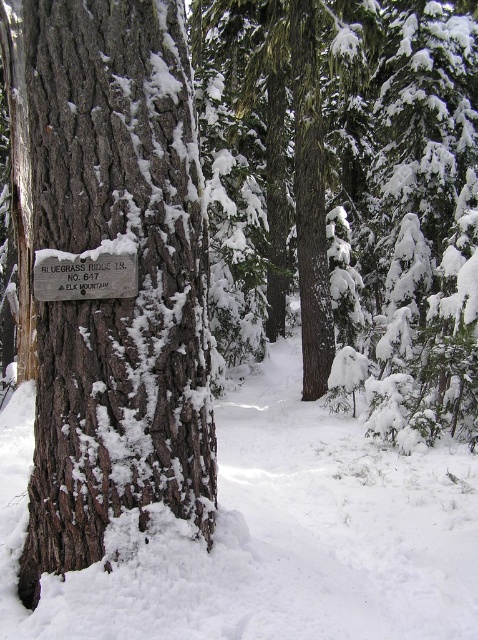
Question: Does dark brown textured bark at center appear over silver metallic sign at left?

Choices:
 (A) yes
 (B) no

Answer: (B)

Question: Is dark brown textured bark at center positioned before white fluffy snow at lower center?

Choices:
 (A) yes
 (B) no

Answer: (B)

Question: Which point appears farthest from the camera in this image?

Choices:
 (A) tap(113, 125)
 (B) tap(467, 545)

Answer: (B)

Question: Among these objects, which one is farthest from the camera?

Choices:
 (A) dark brown textured bark at center
 (B) silver metallic sign at left

Answer: (B)

Question: Can you confirm if dark brown textured bark at center is positioned below silver metallic sign at left?

Choices:
 (A) no
 (B) yes

Answer: (B)

Question: Which of the following is the farthest from the observer?

Choices:
 (A) (75, 282)
 (B) (132, 42)

Answer: (A)